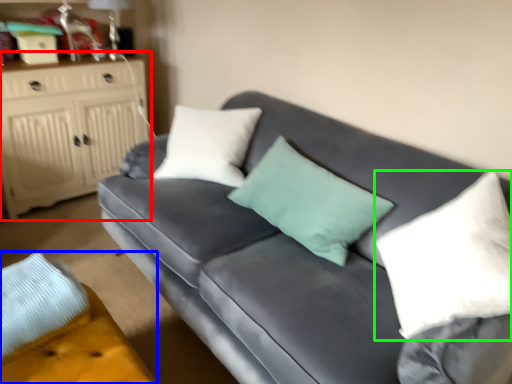
Question: Considering the real-world distances, which object is closest to cabinetry (highlighted by a red box)? footrest (highlighted by a blue box) or pillow (highlighted by a green box).

Choices:
 (A) footrest
 (B) pillow

Answer: (A)